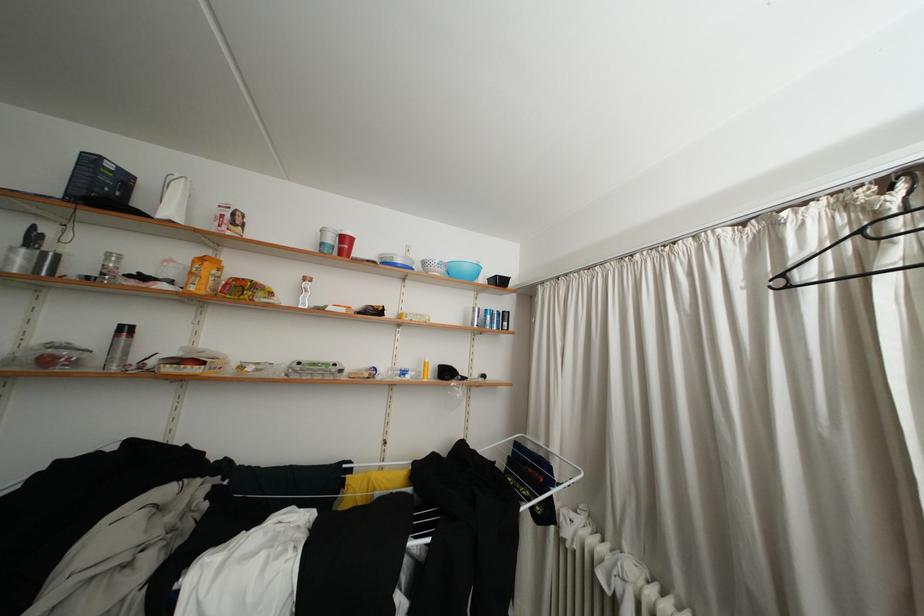
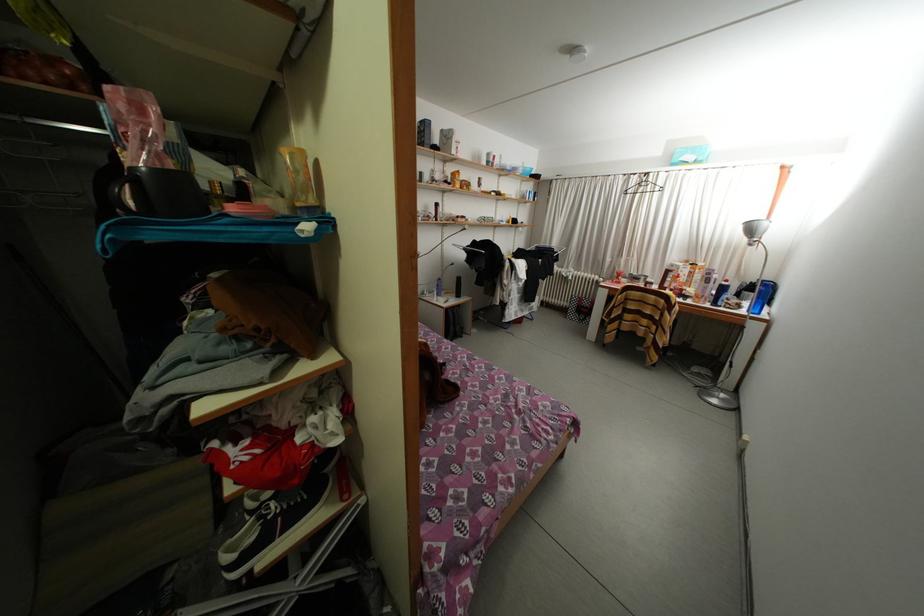
Question: I am providing you with two images of the same scene from different viewpoints. Please identify which objects are invisible in image2.

Choices:
 (A) blue bowl
 (B) blue spray bottle
 (C) silver lamp head
 (D) none of these

Answer: (D)